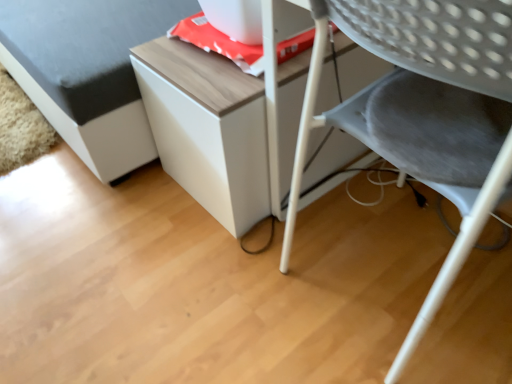
What do you see at coordinates (88, 72) in the screenshot? The width and height of the screenshot is (512, 384). I see `white matte cabinet at upper center` at bounding box center [88, 72].

What is the approximate width of wooden table at center?

24.64 inches.

At what (x,y) coordinates should I click in order to perform the action: click on white matte cabinet at upper center. Please return your answer as a coordinate pair (x, y). Looking at the image, I should click on (88, 72).

Considering the relative sizes of wooden table at center and white matte cabinet at upper center in the image provided, is wooden table at center taller than white matte cabinet at upper center?

Incorrect, the height of wooden table at center is not larger of that of white matte cabinet at upper center.

Does wooden table at center turn towards white matte cabinet at upper center?

No, wooden table at center is not aimed at white matte cabinet at upper center.

Can you tell me how much wooden table at center and white matte cabinet at upper center differ in facing direction?

They differ by 0.927 degrees in their facing directions.

Is there a large distance between wooden table at center and white matte cabinet at upper center?

No.

Does white matte cabinet at upper center have a greater height compared to wooden table at center?

Yes, white matte cabinet at upper center is taller than wooden table at center.

Which object is further away from the camera, white matte cabinet at upper center or wooden table at center?

wooden table at center is further from the camera.

Is white matte cabinet at upper center to the right of wooden table at center from the viewer's perspective?

No, white matte cabinet at upper center is not to the right of wooden table at center.

Considering the sizes of objects white matte cabinet at upper center and wooden table at center in the image provided, who is bigger, white matte cabinet at upper center or wooden table at center?

white matte cabinet at upper center.

Considering the sizes of objects wooden table at center and gray fabric chair at lower right in the image provided, who is taller, wooden table at center or gray fabric chair at lower right?

With more height is gray fabric chair at lower right.

Is the surface of wooden table at center in direct contact with gray fabric chair at lower right?

No, wooden table at center is not beside gray fabric chair at lower right.

From a real-world perspective, who is located higher, wooden table at center or gray fabric chair at lower right?

gray fabric chair at lower right is physically above.

Which object is further away from the camera, wooden table at center or gray fabric chair at lower right?

wooden table at center.

Consider the image. Is gray fabric chair at lower right taller than wooden table at center?

Yes, gray fabric chair at lower right is taller than wooden table at center.

Which object is thinner, gray fabric chair at lower right or wooden table at center?

gray fabric chair at lower right.

Considering the points (309, 107) and (234, 212), which point is behind, point (309, 107) or point (234, 212)?

Positioned behind is point (234, 212).

Could wooden table at center be considered to be inside gray fabric chair at lower right?

No, wooden table at center is not surrounded by gray fabric chair at lower right.

From the image's perspective, is gray fabric chair at lower right located beneath white matte cabinet at upper center?

Correct, gray fabric chair at lower right appears lower than white matte cabinet at upper center in the image.

In the image, is gray fabric chair at lower right on the left side or the right side of white matte cabinet at upper center?

In the image, gray fabric chair at lower right appears on the right side of white matte cabinet at upper center.

Is gray fabric chair at lower right facing away from white matte cabinet at upper center?

No, gray fabric chair at lower right's orientation is not away from white matte cabinet at upper center.

From a real-world perspective, is gray fabric chair at lower right physically located above or below white matte cabinet at upper center?

From a real-world perspective, gray fabric chair at lower right is physically above white matte cabinet at upper center.

What's the angular difference between white matte cabinet at upper center and gray fabric chair at lower right's facing directions?

The angular difference between white matte cabinet at upper center and gray fabric chair at lower right is 179 degrees.

From a real-world perspective, between white matte cabinet at upper center and gray fabric chair at lower right, who is vertically lower?

white matte cabinet at upper center is physically lower.

From the image's perspective, is white matte cabinet at upper center on gray fabric chair at lower right?

Yes, from the image's perspective, white matte cabinet at upper center is over gray fabric chair at lower right.

There is a wooden table at center. Identify the location of furniture above it (from a real-world perspective). (x=88, y=72).

I want to click on table that is below the white matte cabinet at upper center (from the image's perspective), so click(220, 127).

Looking at this image, looking at the image, which one is located further to white matte cabinet at upper center, gray fabric chair at lower right or wooden table at center?

gray fabric chair at lower right lies further to white matte cabinet at upper center than the other object.

Estimate the real-world distances between objects in this image. Which object is closer to gray fabric chair at lower right, white matte cabinet at upper center or wooden table at center?

wooden table at center is positioned closer to the anchor gray fabric chair at lower right.

Which object lies nearer to the anchor point wooden table at center, gray fabric chair at lower right or white matte cabinet at upper center?

gray fabric chair at lower right is closer to wooden table at center.

When comparing their distances from white matte cabinet at upper center, does wooden table at center or gray fabric chair at lower right seem further?

gray fabric chair at lower right is further to white matte cabinet at upper center.

When comparing their distances from gray fabric chair at lower right, does wooden table at center or white matte cabinet at upper center seem further?

Among the two, white matte cabinet at upper center is located further to gray fabric chair at lower right.

Which object lies further to the anchor point wooden table at center, white matte cabinet at upper center or gray fabric chair at lower right?

The object further to wooden table at center is white matte cabinet at upper center.

Locate an element on the screen. Image resolution: width=512 pixels, height=384 pixels. table between white matte cabinet at upper center and gray fabric chair at lower right is located at coordinates (220, 127).